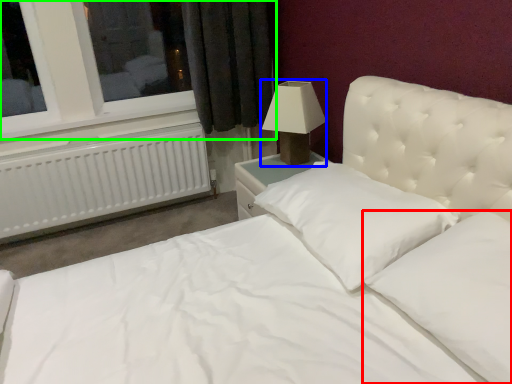
Question: Which object is positioned closest to pillow (highlighted by a red box)? Select from lamp (highlighted by a blue box) and window (highlighted by a green box).

Choices:
 (A) lamp
 (B) window

Answer: (A)